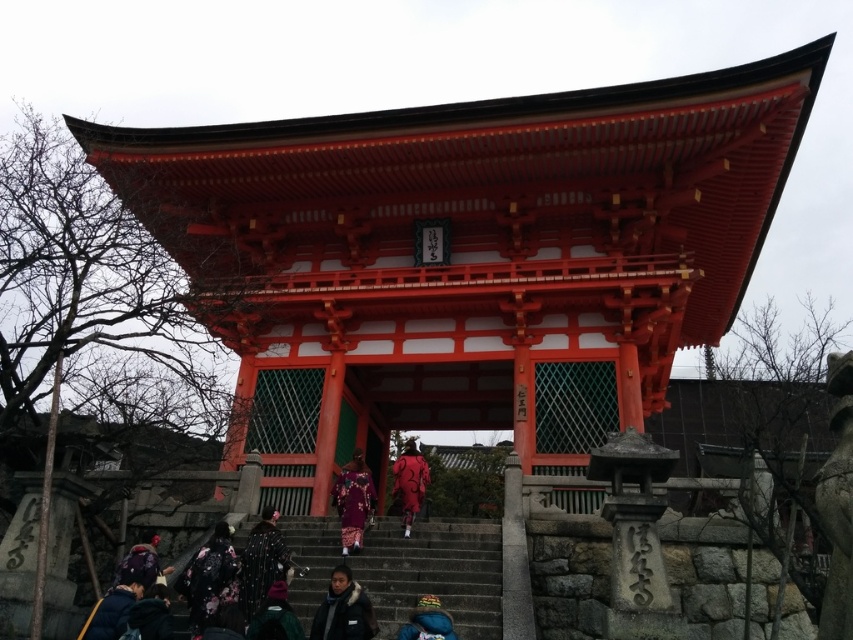
Question: Which point is closer to the camera?

Choices:
 (A) velvet green coat at lower center
 (B) black textured kimono at lower center

Answer: (A)

Question: Does black fuzzy jacket at lower center lie behind velvet green coat at lower center?

Choices:
 (A) yes
 (B) no

Answer: (A)

Question: Does dark gray stone stairs at center have a greater width compared to knitted wool hat at lower center?

Choices:
 (A) yes
 (B) no

Answer: (A)

Question: Estimate the real-world distances between objects in this image. Which object is farther from the red silk kimono at center?

Choices:
 (A) matte black kimono at lower center
 (B) floral kimono at lower left

Answer: (A)

Question: Which point is closer to the camera?

Choices:
 (A) black fuzzy jacket at lower center
 (B) silky purple kimono at center

Answer: (A)

Question: Is silky purple kimono at center above red silk kimono at center?

Choices:
 (A) no
 (B) yes

Answer: (B)